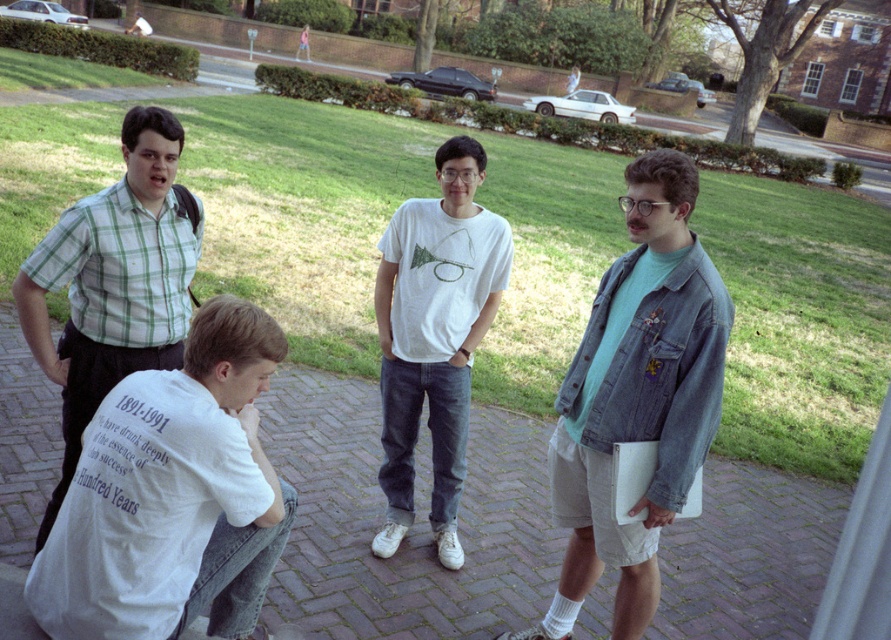
Question: Can you confirm if denim jacket at right is smaller than white cotton t-shirt at center?

Choices:
 (A) yes
 (B) no

Answer: (B)

Question: Which object is farther from the camera taking this photo?

Choices:
 (A) white cotton t-shirt at lower left
 (B) green plaid shirt at left
 (C) white cotton t-shirt at center
 (D) brick pavement at center

Answer: (C)

Question: Which of the following is the farthest from the observer?

Choices:
 (A) (764, 522)
 (B) (156, 188)
 (C) (627, 595)

Answer: (A)

Question: Is brick pavement at center positioned behind white cotton t-shirt at center?

Choices:
 (A) yes
 (B) no

Answer: (B)

Question: Which of these objects is positioned closest to the white cotton t-shirt at center?

Choices:
 (A) denim jacket at right
 (B) brick pavement at center

Answer: (B)

Question: Is brick pavement at center wider than denim jacket at right?

Choices:
 (A) no
 (B) yes

Answer: (B)